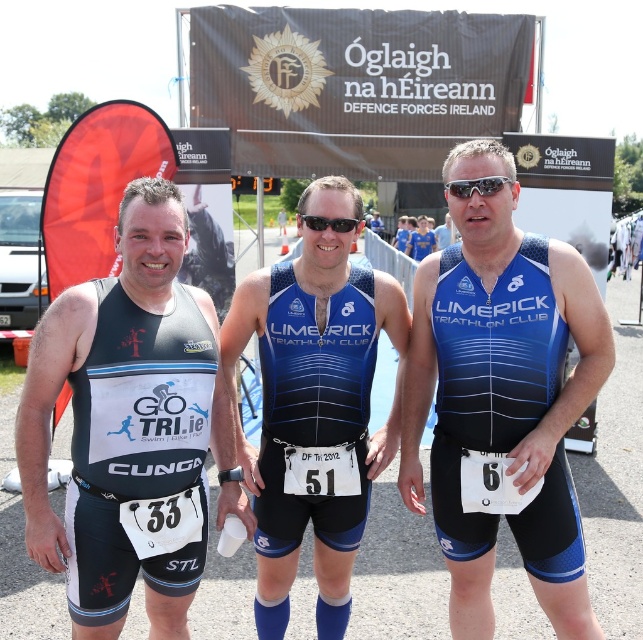
Question: Is blue matte triathlon suit at center wider than sunglasses at center?

Choices:
 (A) yes
 (B) no

Answer: (A)

Question: Among these objects, which one is nearest to the camera?

Choices:
 (A) black plastic goggles at center
 (B) sunglasses at center
 (C) blue/black triathlon suit at center

Answer: (B)

Question: Which point is farther to the camera?

Choices:
 (A) (520, 465)
 (B) (341, 228)
 (C) (322, 611)
 (D) (453, 193)

Answer: (C)

Question: Is blue matte triathlon suit at center to the right of blue/black triathlon suit at center from the viewer's perspective?

Choices:
 (A) yes
 (B) no

Answer: (A)

Question: Which object is closer to the camera taking this photo?

Choices:
 (A) black plastic goggles at center
 (B) sunglasses at center
 (C) matte black triathlon suit at center
 (D) blue/black triathlon suit at center

Answer: (C)

Question: Is matte black triathlon suit at center below black plastic goggles at center?

Choices:
 (A) no
 (B) yes

Answer: (B)